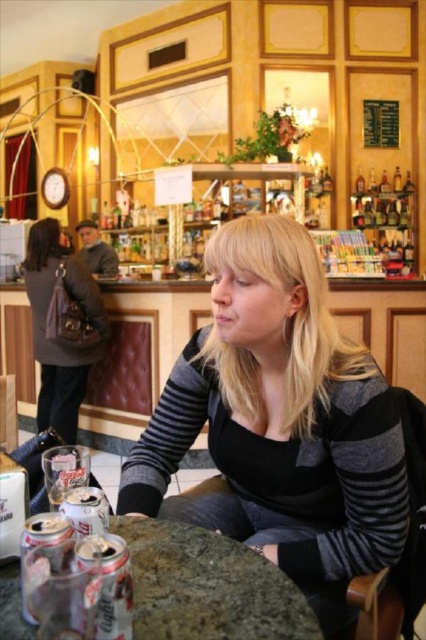
Is striped sweater at center closer to camera compared to granite table at center?

No, it is not.

The height and width of the screenshot is (640, 426). Describe the element at coordinates (279, 422) in the screenshot. I see `striped sweater at center` at that location.

This screenshot has height=640, width=426. Identify the location of striped sweater at center. (279, 422).

Is granite table at center further to camera compared to dark gray wool coat at left?

No, granite table at center is closer to the viewer.

Does granite table at center appear over dark gray wool coat at left?

Incorrect, granite table at center is not positioned above dark gray wool coat at left.

Measure the distance between granite table at center and camera.

The distance of granite table at center from camera is 23.06 inches.

In order to click on granite table at center in this screenshot , I will do `click(207, 588)`.

Consider the image. Which of these two, striped sweater at center or dark gray wool coat at left, stands taller?

Standing taller between the two is dark gray wool coat at left.

Is striped sweater at center smaller than dark gray wool coat at left?

Correct, striped sweater at center occupies less space than dark gray wool coat at left.

Which is behind, point (339, 625) or point (40, 284)?

Positioned behind is point (40, 284).

In order to click on striped sweater at center in this screenshot , I will do `click(279, 422)`.